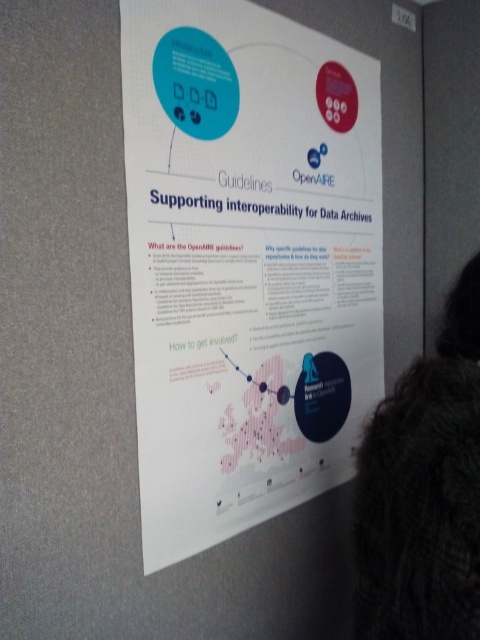
Can you confirm if white paper poster at center is positioned below fuzzy brown fur at lower right?

No, white paper poster at center is not below fuzzy brown fur at lower right.

Describe the element at coordinates (247, 262) in the screenshot. I see `white paper poster at center` at that location.

Describe the element at coordinates (247, 262) in the screenshot. This screenshot has width=480, height=640. I see `white paper poster at center` at that location.

At what (x,y) coordinates should I click in order to perform the action: click on white paper poster at center. Please return your answer as a coordinate pair (x, y). The height and width of the screenshot is (640, 480). Looking at the image, I should click on pyautogui.click(x=247, y=262).